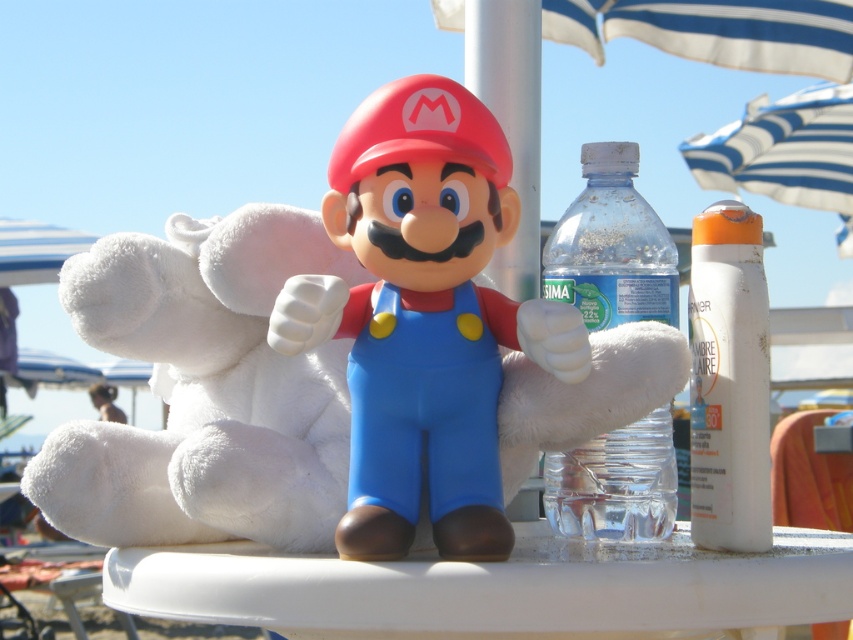
Between point (653, 472) and point (735, 472), which one is positioned behind?

The point (653, 472) is more distant.

Which is in front, point (581, 289) or point (743, 253)?

Positioned in front is point (743, 253).

At what (x,y) coordinates should I click in order to perform the action: click on transparent plastic bottle at center. Please return your answer as a coordinate pair (x, y). This screenshot has height=640, width=853. Looking at the image, I should click on (611, 246).

Is white plastic table at center to the left of transparent plastic bottle at center from the viewer's perspective?

Indeed, white plastic table at center is positioned on the left side of transparent plastic bottle at center.

Describe the element at coordinates (497, 588) in the screenshot. I see `white plastic table at center` at that location.

You are a GUI agent. You are given a task and a screenshot of the screen. Output one action in this format:
    pyautogui.click(x=<x>, y=<y>)
    Task: Click on the white plastic table at center
    
    Given the screenshot: What is the action you would take?
    pyautogui.click(x=497, y=588)

Is matte plastic mario at center shorter than white plastic table at center?

No.

Does matte plastic mario at center have a smaller size compared to white plastic table at center?

Indeed, matte plastic mario at center has a smaller size compared to white plastic table at center.

Is point (363, 369) closer to camera compared to point (175, 616)?

No.

Image resolution: width=853 pixels, height=640 pixels. Find the location of `matte plastic mario at center`. matte plastic mario at center is located at coordinates (424, 317).